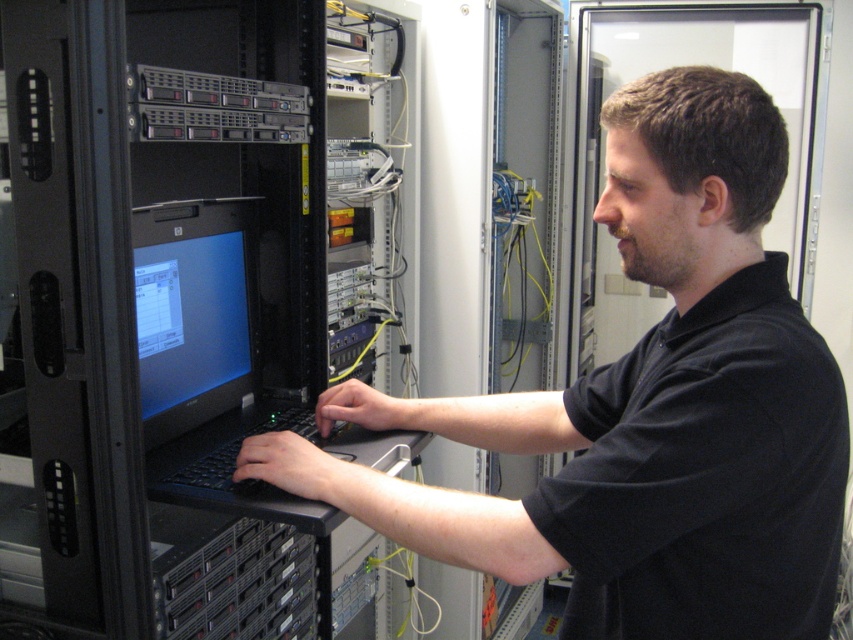
Consider the image. You are a technician in a server room. You need to locate a specific point on the server rack. The point is at coordinates (646, 406). Where exactly is this point located?

The point at coordinates (646, 406) is located on the black matte computer at center.